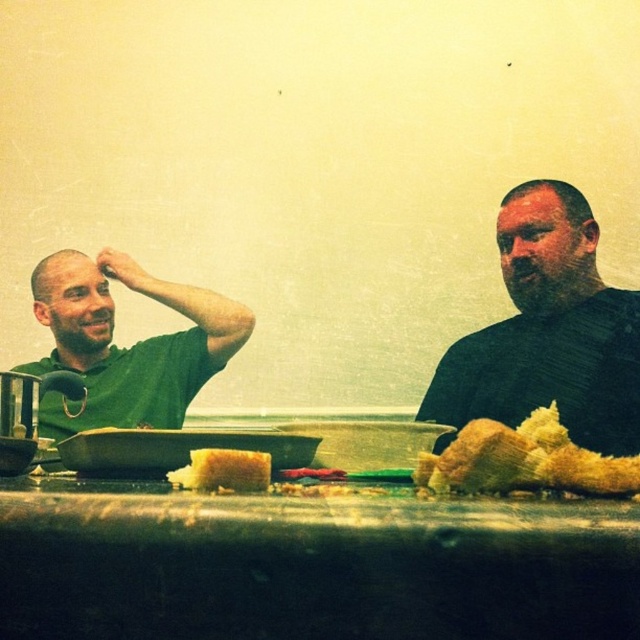
Question: Which is nearer to the golden crispy bread at right?

Choices:
 (A) green matte shirt at upper left
 (B) yellow crumbly bread at center
 (C) shiny metallic table at center
 (D) dark green sweater at right

Answer: (C)

Question: Considering the relative positions of dark green sweater at right and golden crispy bread at right in the image provided, where is dark green sweater at right located with respect to golden crispy bread at right?

Choices:
 (A) above
 (B) below

Answer: (A)

Question: Which point is farther to the camera?

Choices:
 (A) shiny metallic table at center
 (B) yellow crumbly bread at center
 (C) green matte shirt at upper left

Answer: (C)

Question: Can you confirm if green matte shirt at upper left is thinner than golden crispy bread at right?

Choices:
 (A) no
 (B) yes

Answer: (A)

Question: Is dark green sweater at right wider than green matte shirt at upper left?

Choices:
 (A) no
 (B) yes

Answer: (A)

Question: Which object is the closest to the yellow crumbly bread at center?

Choices:
 (A) shiny metallic table at center
 (B) golden crispy bread at right
 (C) green matte shirt at upper left
 (D) dark green sweater at right

Answer: (A)